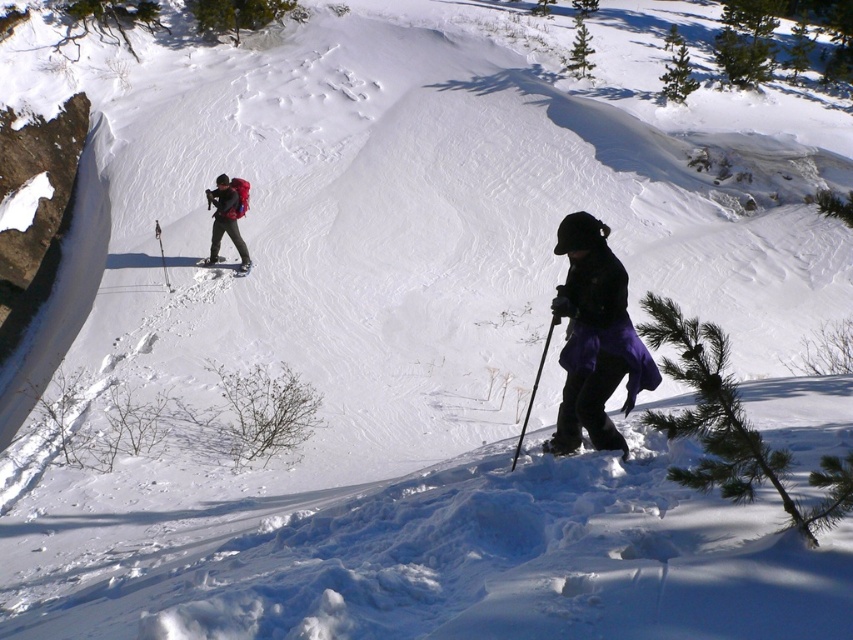
Can you confirm if green needle-like pine at lower right is thinner than matte black ski at upper center?

No, green needle-like pine at lower right is not thinner than matte black ski at upper center.

Does green needle-like pine at lower right come in front of matte black ski at upper center?

That is True.

Consider the image. Who is more forward, (682,429) or (199,264)?

Point (682,429) is in front.

Where is `green needle-like pine at lower right`? The height and width of the screenshot is (640, 853). green needle-like pine at lower right is located at coordinates (730, 426).

Between point (608, 227) and point (553, 308), which one is positioned in front?

Point (553, 308) is more forward.

Between purple fabric skirt at lower center and black plastic ski pole at lower center, which one is positioned higher?

Positioned higher is purple fabric skirt at lower center.

Locate an element on the screen. purple fabric skirt at lower center is located at coordinates (595, 339).

Between purple fabric skirt at lower center and matte black ski at upper center, which one is positioned higher?

matte black ski at upper center is above.

Is purple fabric skirt at lower center to the left of matte black ski at upper center from the viewer's perspective?

Incorrect, purple fabric skirt at lower center is not on the left side of matte black ski at upper center.

The image size is (853, 640). In order to click on purple fabric skirt at lower center in this screenshot , I will do `click(595, 339)`.

In order to click on purple fabric skirt at lower center in this screenshot , I will do `click(595, 339)`.